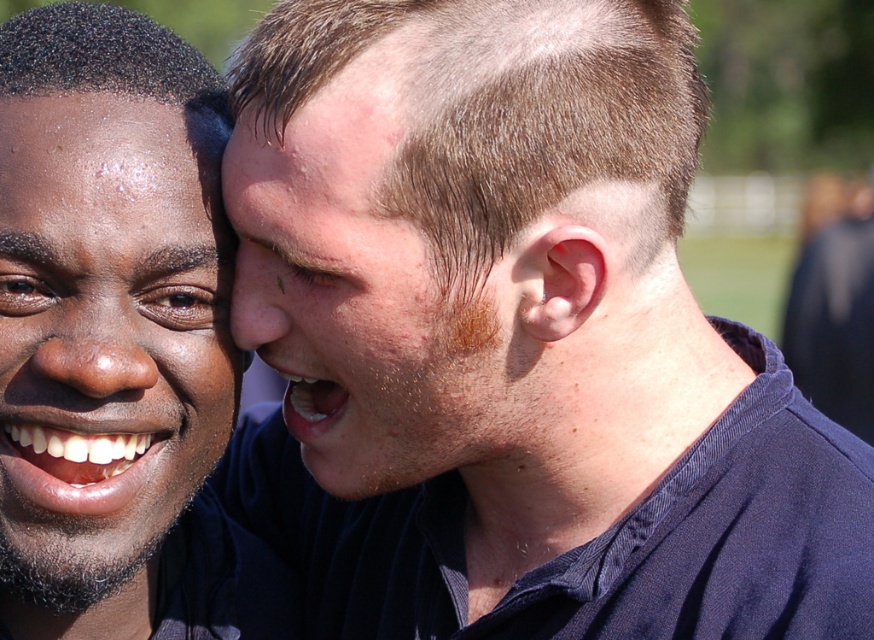
Question: Can you confirm if matte black face at left is bigger than dry skin at center?

Choices:
 (A) yes
 (B) no

Answer: (B)

Question: Considering the relative positions of matte black face at left and dry skin at center in the image provided, where is matte black face at left located with respect to dry skin at center?

Choices:
 (A) left
 (B) right

Answer: (A)

Question: Is matte black face at left below dry skin at center?

Choices:
 (A) no
 (B) yes

Answer: (B)

Question: Which object appears farthest from the camera in this image?

Choices:
 (A) dry skin at center
 (B) matte black face at left

Answer: (B)

Question: Which point appears closest to the camera in this image?

Choices:
 (A) (434, 330)
 (B) (63, 115)

Answer: (B)